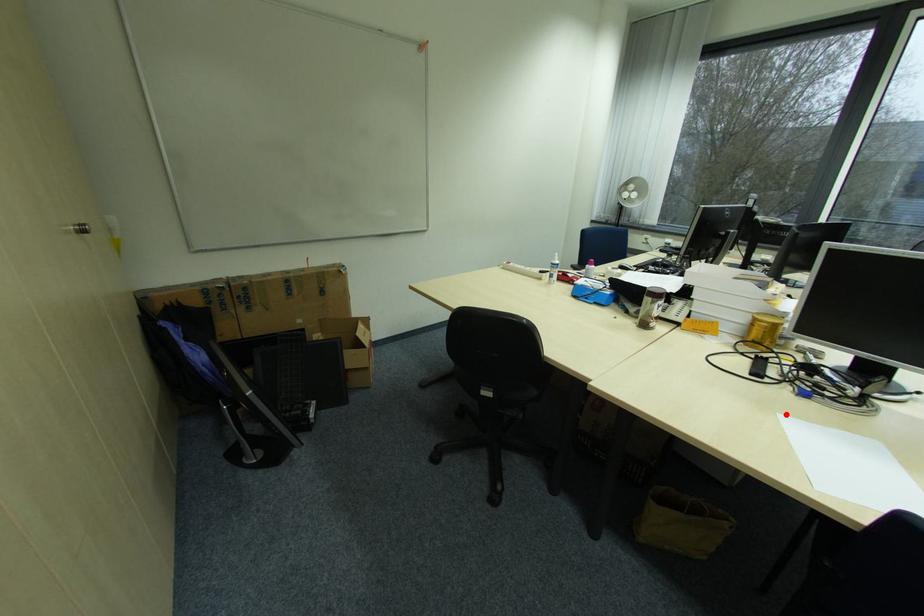
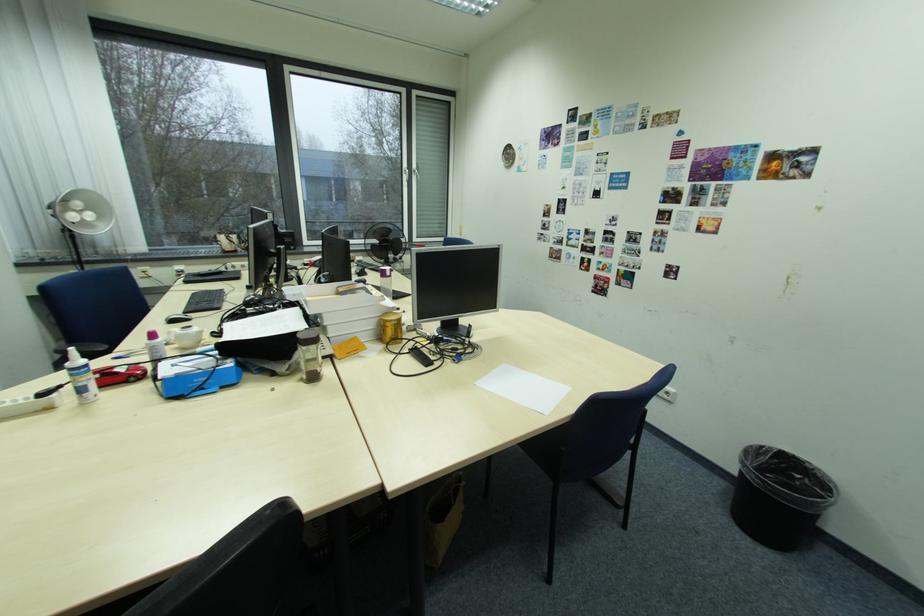
Locate, in the second image, the point that corresponds to the highlighted location in the first image.

(482, 384)